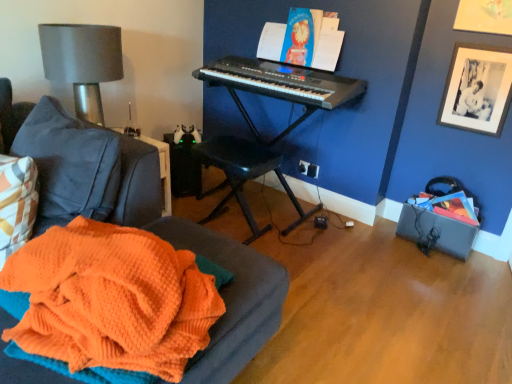
Identify the location of vacant space underneath black plastic keyboard at center (from a real-world perspective). The height and width of the screenshot is (384, 512). (271, 210).